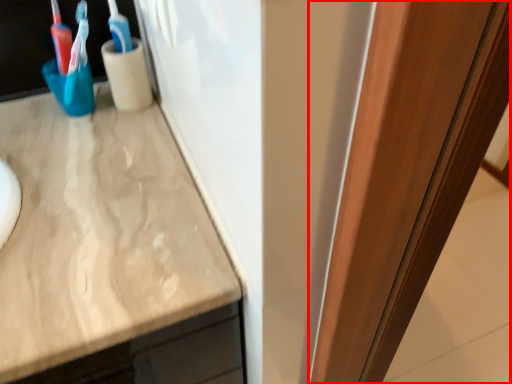
Question: From the image's perspective, where is glass door (annotated by the red box) located relative to toothbrush?

Choices:
 (A) below
 (B) above

Answer: (A)